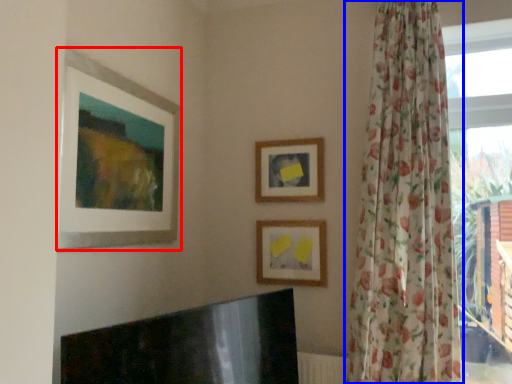
Question: Which object is further to the camera taking this photo, picture frame (highlighted by a red box) or curtain (highlighted by a blue box)?

Choices:
 (A) picture frame
 (B) curtain

Answer: (B)